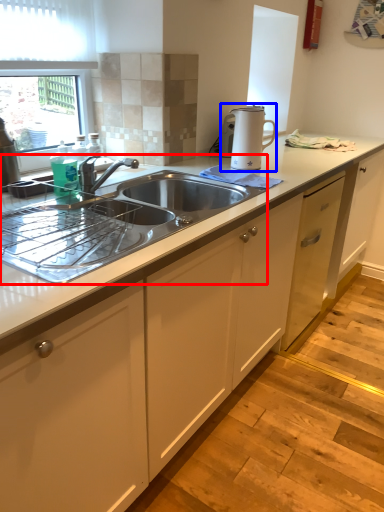
Question: Which of the following is the closest to the observer, sink (highlighted by a red box) or home appliance (highlighted by a blue box)?

Choices:
 (A) sink
 (B) home appliance

Answer: (A)